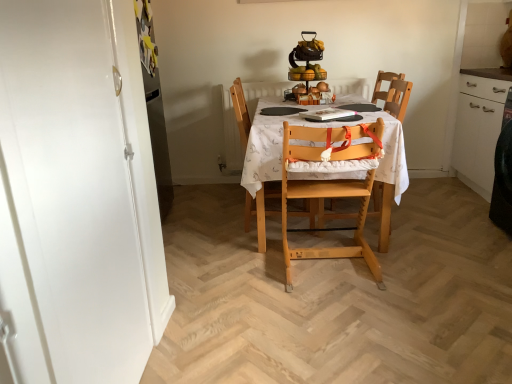
Identify the location of vacant area that is situated to the right of light wood highchair at center, which is counted as the second chair, starting from the left. (413, 259).